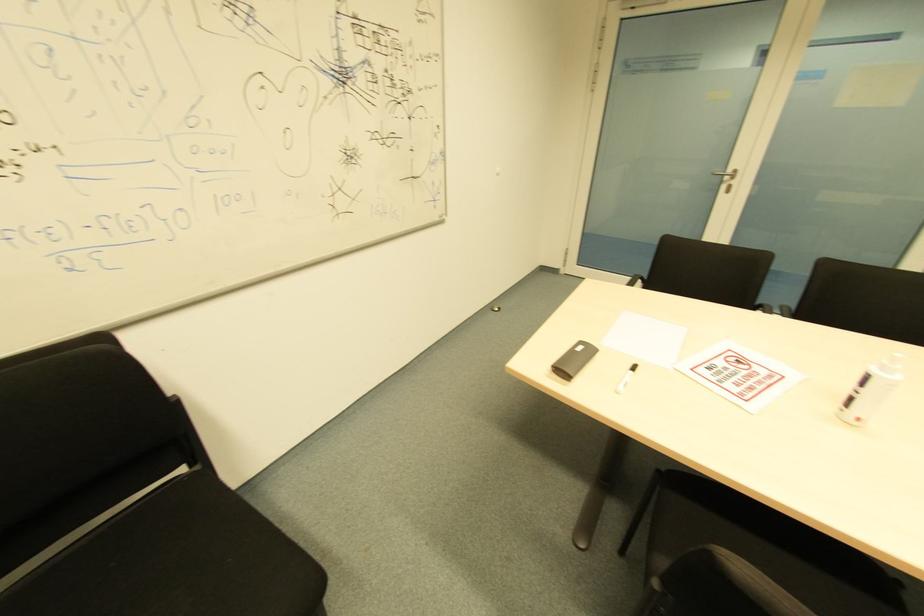
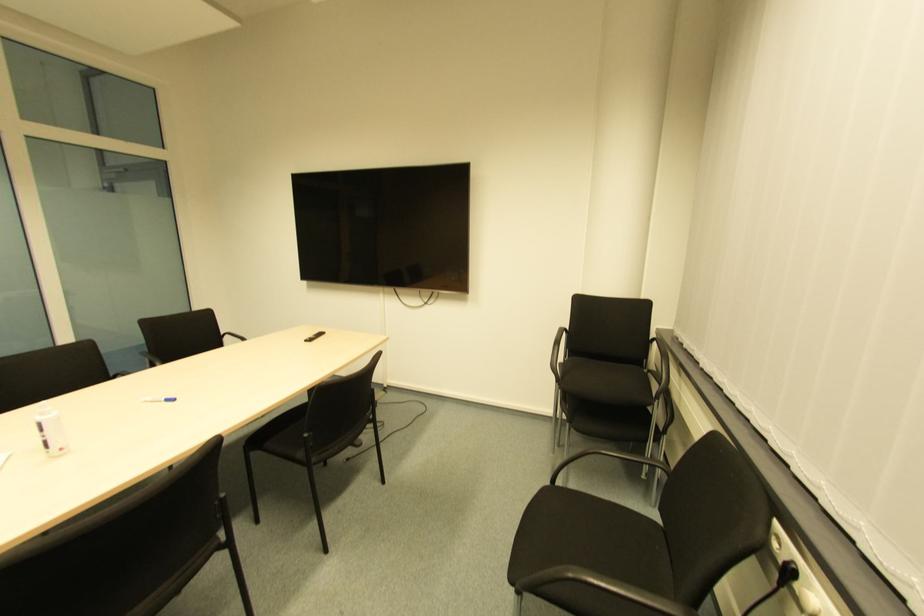
First-person continuous shooting, in which direction is the camera rotating?

The rotation direction of the camera is right-down.